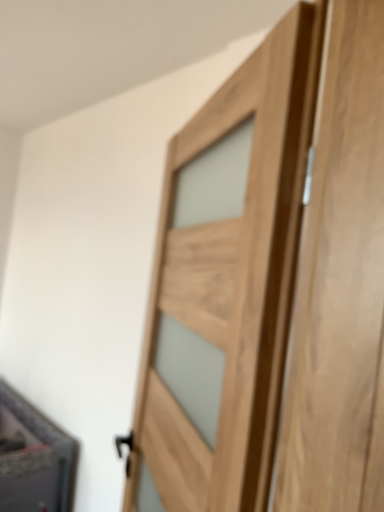
Measure the distance between point [26,502] and camera.

Point [26,502] and camera are 6.72 feet apart.

The width and height of the screenshot is (384, 512). Describe the element at coordinates (32, 458) in the screenshot. I see `matte black cabinet at lower left` at that location.

The width and height of the screenshot is (384, 512). I want to click on matte black cabinet at lower left, so click(x=32, y=458).

What is the approximate height of matte black cabinet at lower left?

The height of matte black cabinet at lower left is 29.71 inches.

In order to face natural wood door at center, should I rotate leftwards or rightwards?

You should rotate left by 1.728 degrees.

This screenshot has width=384, height=512. What are the coordinates of `natural wood door at center` in the screenshot? It's located at (224, 287).

Describe the element at coordinates (224, 287) in the screenshot. I see `natural wood door at center` at that location.

In order to click on matte black cabinet at lower left in this screenshot , I will do `click(32, 458)`.

Consider the image. Is matte black cabinet at lower left to the left of natural wood door at center from the viewer's perspective?

Indeed, matte black cabinet at lower left is positioned on the left side of natural wood door at center.

Relative to natural wood door at center, is matte black cabinet at lower left in front or behind?

Clearly, matte black cabinet at lower left is behind natural wood door at center.

Does point (67, 452) appear closer or farther from the camera than point (264, 173)?

Point (67, 452) is positioned farther from the camera compared to point (264, 173).

From the image's perspective, relative to natural wood door at center, is matte black cabinet at lower left above or below?

matte black cabinet at lower left is situated lower than natural wood door at center in the image.

From a real-world perspective, between matte black cabinet at lower left and natural wood door at center, who is vertically higher?

In real-world perspective, natural wood door at center is above.

Which object is wider, matte black cabinet at lower left or natural wood door at center?

matte black cabinet at lower left is wider.

Consider the image. Between matte black cabinet at lower left and natural wood door at center, which one has less height?

matte black cabinet at lower left is shorter.

Which of these two, matte black cabinet at lower left or natural wood door at center, is bigger?

With larger size is matte black cabinet at lower left.

From the picture: Can we say matte black cabinet at lower left lies outside natural wood door at center?

Yes, matte black cabinet at lower left is not within natural wood door at center.

From the picture: Are matte black cabinet at lower left and natural wood door at center far apart?

Yes, matte black cabinet at lower left and natural wood door at center are located far from each other.

Is matte black cabinet at lower left facing away from natural wood door at center?

No, matte black cabinet at lower left is not facing the opposite direction of natural wood door at center.

How different are the orientations of matte black cabinet at lower left and natural wood door at center in degrees?

24.2 degrees separate the facing orientations of matte black cabinet at lower left and natural wood door at center.

I want to click on cabinetry beneath the natural wood door at center (from a real-world perspective), so click(32, 458).

Is natural wood door at center at the right side of matte black cabinet at lower left?

Yes.

Is natural wood door at center further to the viewer compared to matte black cabinet at lower left?

No, the depth of natural wood door at center is less than that of matte black cabinet at lower left.

Considering the positions of point (194, 301) and point (12, 389), is point (194, 301) closer or farther from the camera than point (12, 389)?

Point (194, 301) appears to be closer to the viewer than point (12, 389).

Consider the image. From the image's perspective, which is above, natural wood door at center or matte black cabinet at lower left?

natural wood door at center.

From a real-world perspective, is natural wood door at center located beneath matte black cabinet at lower left?

Actually, natural wood door at center is physically above matte black cabinet at lower left in the real world.

Between natural wood door at center and matte black cabinet at lower left, which one has smaller width?

Thinner between the two is natural wood door at center.

Is natural wood door at center taller or shorter than matte black cabinet at lower left?

In the image, natural wood door at center appears to be taller than matte black cabinet at lower left.

Considering the relative sizes of natural wood door at center and matte black cabinet at lower left in the image provided, is natural wood door at center smaller than matte black cabinet at lower left?

Correct, natural wood door at center occupies less space than matte black cabinet at lower left.

Is natural wood door at center surrounding matte black cabinet at lower left?

No.

Would you consider natural wood door at center to be distant from matte black cabinet at lower left?

Absolutely, natural wood door at center is distant from matte black cabinet at lower left.

Could you tell me if natural wood door at center is turned towards matte black cabinet at lower left?

No, natural wood door at center is not oriented towards matte black cabinet at lower left.

How many degrees apart are the facing directions of natural wood door at center and matte black cabinet at lower left?

The angle between the facing direction of natural wood door at center and the facing direction of matte black cabinet at lower left is 24.2 degrees.

How much distance is there between natural wood door at center and matte black cabinet at lower left?

They are 1.47 meters apart.

Find the location of a particular element. The image size is (384, 512). cabinetry below the natural wood door at center (from the image's perspective) is located at coordinates (32, 458).

Where is `door above the matte black cabinet at lower left (from the image's perspective)`? door above the matte black cabinet at lower left (from the image's perspective) is located at coordinates (224, 287).

At what (x,y) coordinates should I click in order to perform the action: click on door on the right of matte black cabinet at lower left. Please return your answer as a coordinate pair (x, y). Looking at the image, I should click on (224, 287).